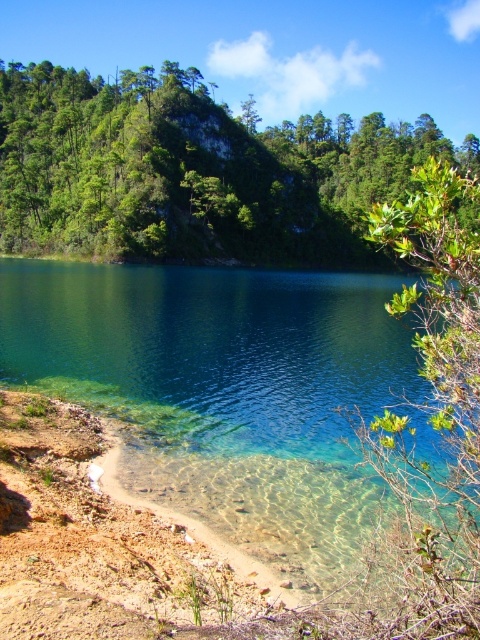
Question: Can you confirm if green leafy trees at upper center is positioned to the right of clear glass lake at lower left?

Choices:
 (A) yes
 (B) no

Answer: (B)

Question: Which object is farther from the camera taking this photo?

Choices:
 (A) clear glass lake at lower left
 (B) green leafy trees at upper center

Answer: (B)

Question: Does green leafy trees at upper center have a smaller size compared to clear glass lake at lower left?

Choices:
 (A) yes
 (B) no

Answer: (B)

Question: Can you confirm if green leafy trees at upper center is thinner than clear glass lake at lower left?

Choices:
 (A) no
 (B) yes

Answer: (A)